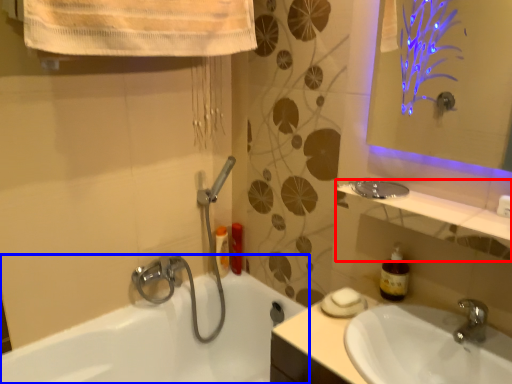
Question: Which of the following is the closest to the observer, balustrade (highlighted by a red box) or bathtub (highlighted by a blue box)?

Choices:
 (A) balustrade
 (B) bathtub

Answer: (B)